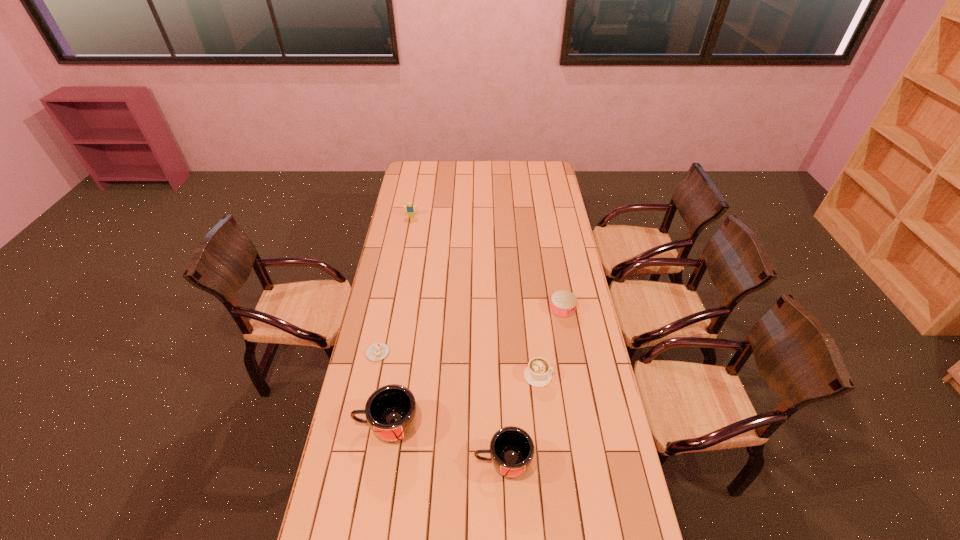
Please point a vacant point for placing a mug on the right. Please provide its 2D coordinates. Your answer should be formatted as a tuple, i.e. [(x, y)], where the tuple contains the x and y coordinates of a point satisfying the conditions above.

[(635, 504)]